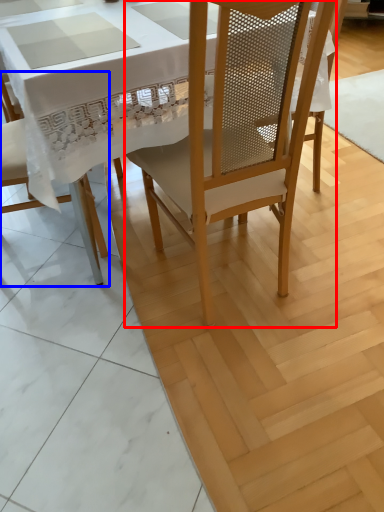
Question: Which object appears closest to the camera in this image, chair (highlighted by a red box) or chair (highlighted by a blue box)?

Choices:
 (A) chair
 (B) chair

Answer: (A)